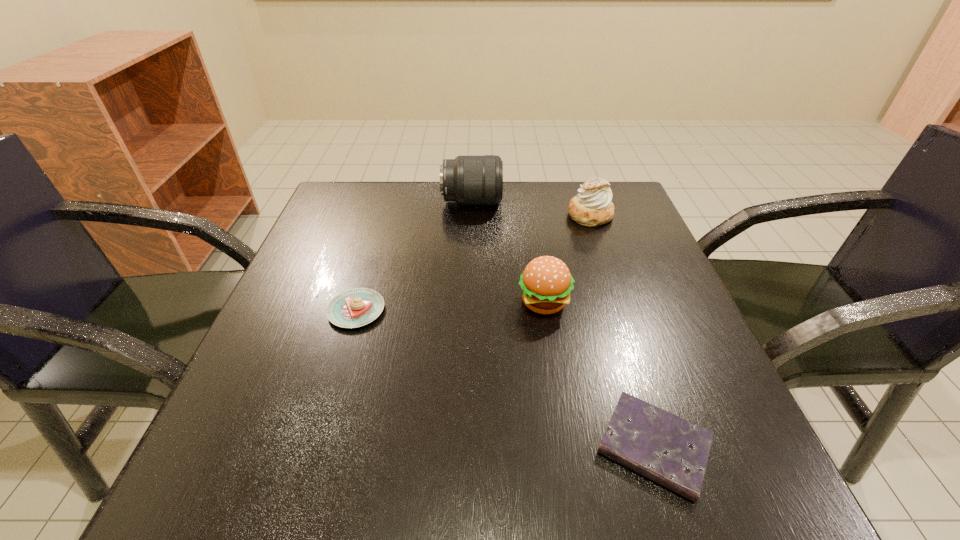
What are the coordinates of `object that can be found as the fourth closest to the taller pastry` in the screenshot? It's located at (667, 449).

At what (x,y) coordinates should I click in order to perform the action: click on free location that satisfies the following two spatial constraints: 1. on the surface of the shortest object; 2. on the right side of the telephoto lens. Please return your answer as a coordinate pair (x, y). Looking at the image, I should click on (465, 447).

Locate an element on the screen. The width and height of the screenshot is (960, 540). vacant space that satisfies the following two spatial constraints: 1. on the front side of the hamburger; 2. on the left side of the nearest object is located at coordinates (566, 447).

Image resolution: width=960 pixels, height=540 pixels. I want to click on free space that satisfies the following two spatial constraints: 1. on the back side of the hamburger; 2. on the surface of the telephoto lens, so click(x=528, y=201).

In order to click on vacant space that satisfies the following two spatial constraints: 1. on the back side of the nearest object; 2. on the surface of the tallest object in this screenshot , I will do `click(577, 201)`.

The height and width of the screenshot is (540, 960). What are the coordinates of `vacant space that satisfies the following two spatial constraints: 1. on the front side of the diary; 2. on the left side of the hamburger` in the screenshot? It's located at (566, 447).

Locate an element on the screen. The height and width of the screenshot is (540, 960). free space that satisfies the following two spatial constraints: 1. on the back side of the right pastry; 2. on the surface of the second object from left to right is located at coordinates (586, 201).

Where is `vacant region that satisfies the following two spatial constraints: 1. on the surface of the telephoto lens; 2. on the left side of the diary`? The height and width of the screenshot is (540, 960). vacant region that satisfies the following two spatial constraints: 1. on the surface of the telephoto lens; 2. on the left side of the diary is located at coordinates (465, 447).